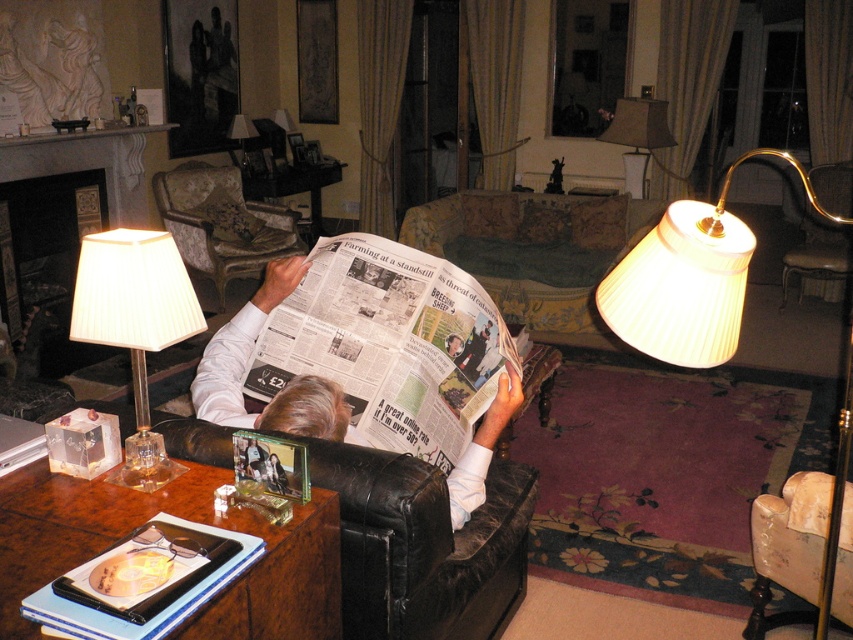
Question: Which of these objects is positioned closest to the white pleated lampshade at upper right?

Choices:
 (A) green fabric couch at center
 (B) white leather couch at center
 (C) white paper newspaper at center
 (D) white pleated fabric lampshade at left

Answer: (B)

Question: Which object appears farthest from the camera in this image?

Choices:
 (A) white leather couch at center
 (B) white pleated fabric lampshade at left

Answer: (A)

Question: Is green fabric couch at center bigger than white pleated lampshade at upper center?

Choices:
 (A) no
 (B) yes

Answer: (B)

Question: Which point is closer to the camera taking this photo?

Choices:
 (A) (732, 163)
 (B) (196, 170)
 (C) (109, 241)
 (D) (511, 381)

Answer: (C)

Question: Can you confirm if white pleated lampshade at upper right is positioned below white paper newspaper at center?

Choices:
 (A) no
 (B) yes

Answer: (B)

Question: Can you confirm if white pleated lampshade at upper right is positioned to the right of white pleated lampshade at upper center?

Choices:
 (A) yes
 (B) no

Answer: (B)